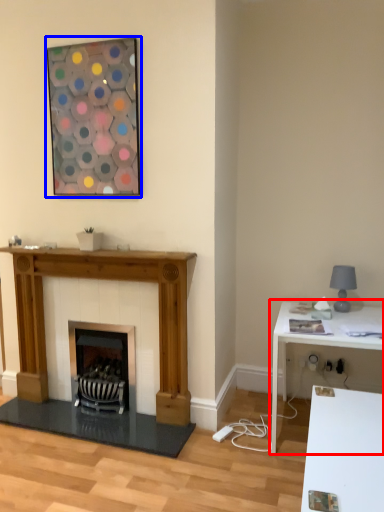
Question: Which point is closer to the camera, table (highlighted by a red box) or picture frame (highlighted by a blue box)?

Choices:
 (A) table
 (B) picture frame

Answer: (A)